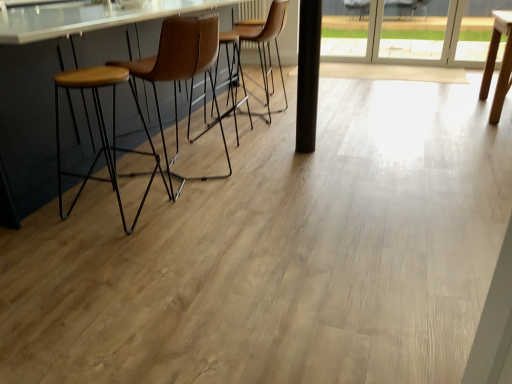
Locate an element on the screen. Image resolution: width=512 pixels, height=384 pixels. vacant region to the right of black matte pole at center is located at coordinates 332,144.